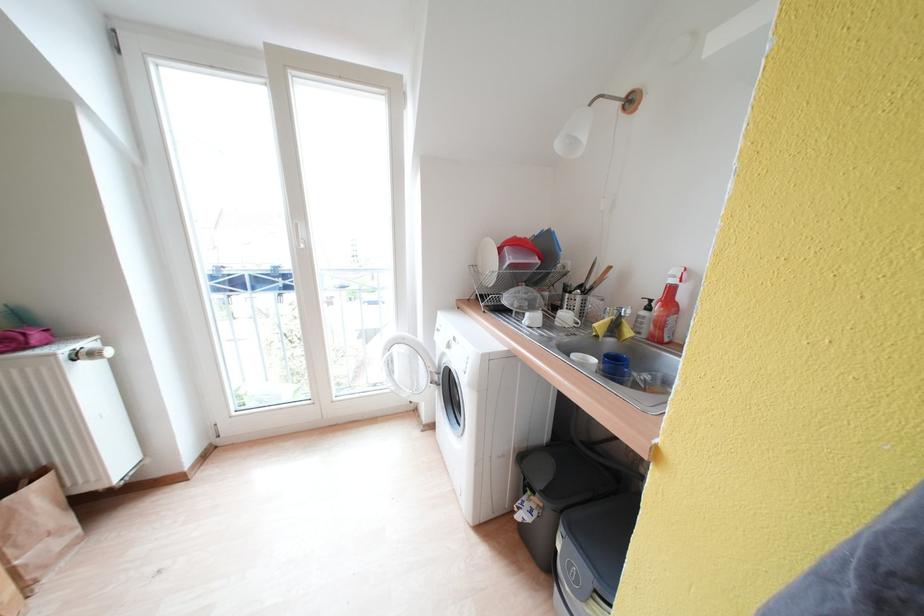
Find where to push the washing machine door. Please return your answer as a coordinate pair (x, y).

(407, 367)